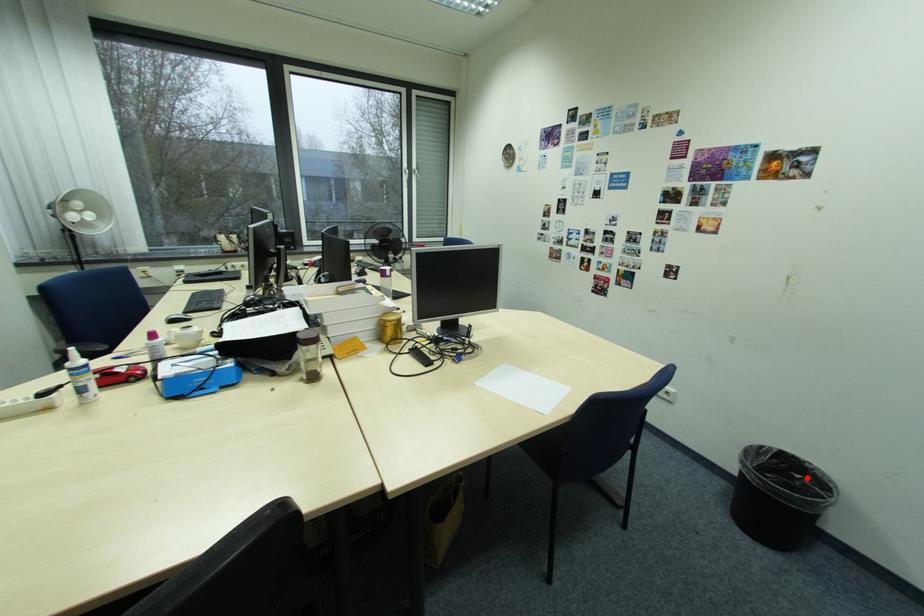
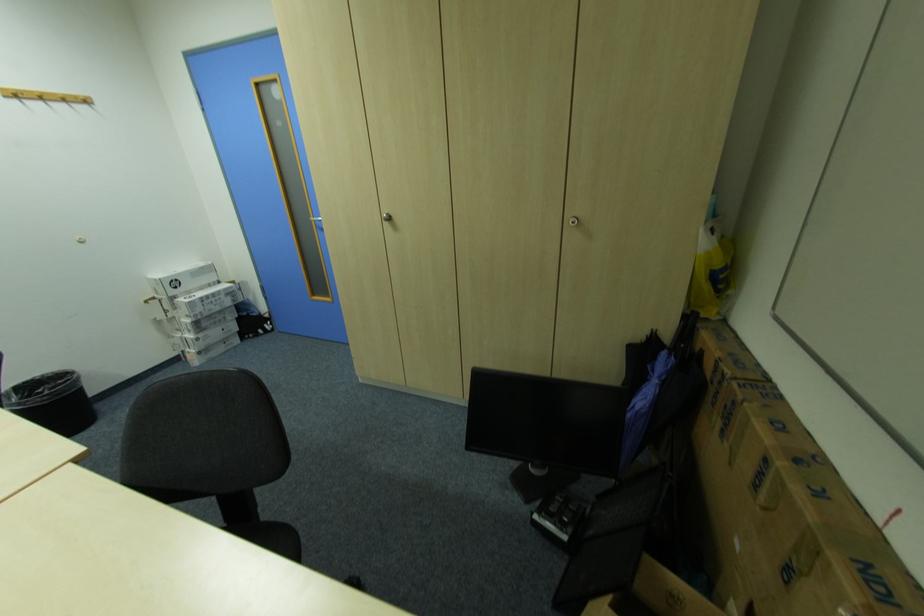
Question: I am providing you with two images of the same scene from different viewpoints. A red point is marked on the first image. Is the red point's position out of view in image 2?

Choices:
 (A) Yes
 (B) No

Answer: (B)